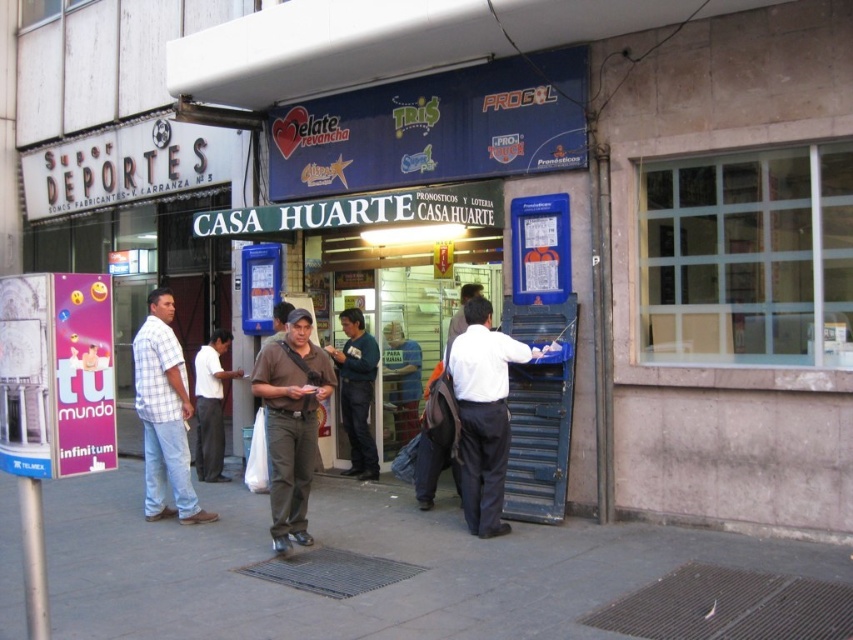
Which of these two, matte brown shirt at center or light blue jeans at left, stands shorter?

matte brown shirt at center is shorter.

Between point (282, 371) and point (166, 451), which one is positioned behind?

The point (166, 451) is more distant.

What do you see at coordinates (291, 422) in the screenshot? I see `matte brown shirt at center` at bounding box center [291, 422].

Where is `matte brown shirt at center`? The image size is (853, 640). matte brown shirt at center is located at coordinates 291,422.

You are a GUI agent. You are given a task and a screenshot of the screen. Output one action in this format:
    pyautogui.click(x=<x>, y=<y>)
    Task: Click on the light blue jeans at left
    This screenshot has height=640, width=853.
    Given the screenshot: What is the action you would take?
    pyautogui.click(x=164, y=413)

Is point (183, 518) positioned before point (366, 413)?

Yes, point (183, 518) is in front of point (366, 413).

Who is more forward, (175, 460) or (341, 378)?

Point (175, 460)

Identify the location of light blue jeans at left. (164, 413).

Which is more to the left, matte brown shirt at center or white smooth shirt at center?

Positioned to the left is matte brown shirt at center.

Who is taller, matte brown shirt at center or white smooth shirt at center?

white smooth shirt at center is taller.

Is point (281, 547) in front of point (517, 353)?

Yes.

I want to click on matte brown shirt at center, so click(x=291, y=422).